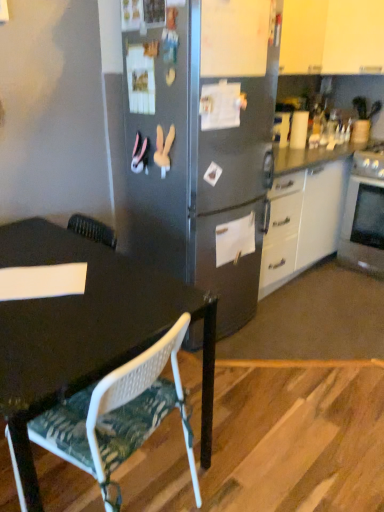
Question: From a real-world perspective, is white mesh chair at lower left located beneath white matte cabinet at upper right?

Choices:
 (A) no
 (B) yes

Answer: (B)

Question: Is white mesh chair at lower left looking in the opposite direction of white matte cabinet at upper right?

Choices:
 (A) yes
 (B) no

Answer: (B)

Question: Does white mesh chair at lower left have a smaller size compared to white matte cabinet at upper right?

Choices:
 (A) yes
 (B) no

Answer: (A)

Question: Does white mesh chair at lower left appear on the left side of white matte cabinet at upper right?

Choices:
 (A) yes
 (B) no

Answer: (A)

Question: Considering the relative sizes of white mesh chair at lower left and white matte cabinet at upper right in the image provided, is white mesh chair at lower left thinner than white matte cabinet at upper right?

Choices:
 (A) yes
 (B) no

Answer: (A)

Question: Is white mesh chair at lower left facing towards white matte cabinet at upper right?

Choices:
 (A) yes
 (B) no

Answer: (B)

Question: Is white matte cabinet at upper right facing away from white mesh chair at lower left?

Choices:
 (A) yes
 (B) no

Answer: (B)

Question: From a real-world perspective, is white matte cabinet at upper right on white mesh chair at lower left?

Choices:
 (A) yes
 (B) no

Answer: (A)

Question: Is white matte cabinet at upper right positioned behind white mesh chair at lower left?

Choices:
 (A) no
 (B) yes

Answer: (B)

Question: Is white mesh chair at lower left inside white matte cabinet at upper right?

Choices:
 (A) yes
 (B) no

Answer: (B)

Question: Would you consider white matte cabinet at upper right to be distant from white mesh chair at lower left?

Choices:
 (A) no
 (B) yes

Answer: (B)

Question: From the image's perspective, is white matte cabinet at upper right below white mesh chair at lower left?

Choices:
 (A) yes
 (B) no

Answer: (B)

Question: Considering the relative positions of white mesh chair at lower left and silver metallic oven at right in the image provided, is white mesh chair at lower left to the right of silver metallic oven at right from the viewer's perspective?

Choices:
 (A) no
 (B) yes

Answer: (A)